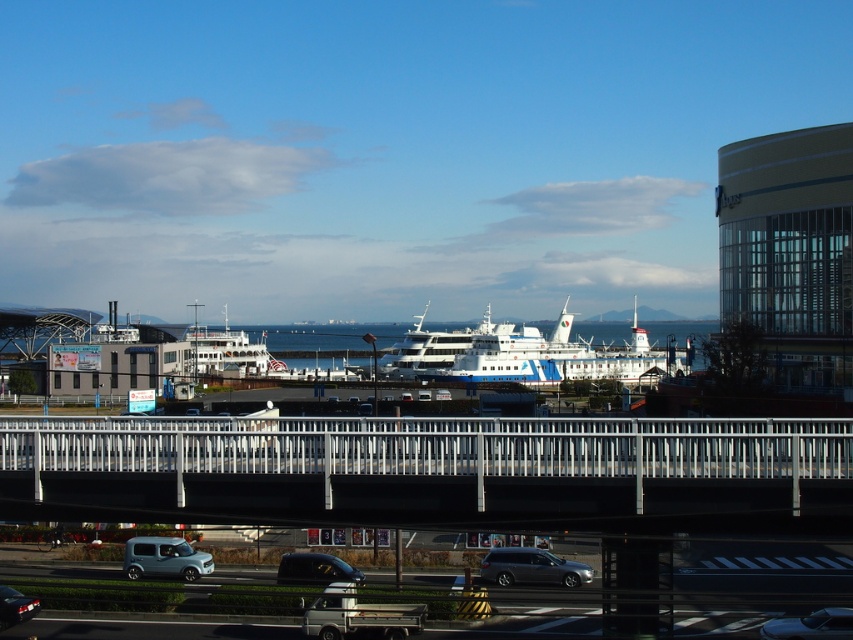
Consider the image. You are a pedestrian standing on the pedestrian walkway below the road. You want to cross to the other side of the road. Can you step onto the metallic blue suv at lower left to reach the matte black car at lower left?

The metallic blue suv at lower left is located above the matte black car at lower left, so you can step onto the metallic blue suv at lower left to reach the matte black car at lower left.

You are driving a car that is 4.5 meters long. You need to park your car between the metallic gray station wagon at center and the metallic silver car at lower right. Is there enough space between them to park your car?

The metallic gray station wagon at center and metallic silver car at lower right are 11.11 meters apart. Since your car is only 4.5 meters long, there is sufficient space between them to park your car.

What are the coordinates of the silver metallic bridge at center?

The silver metallic bridge at center is located at coordinates point (432, 470).